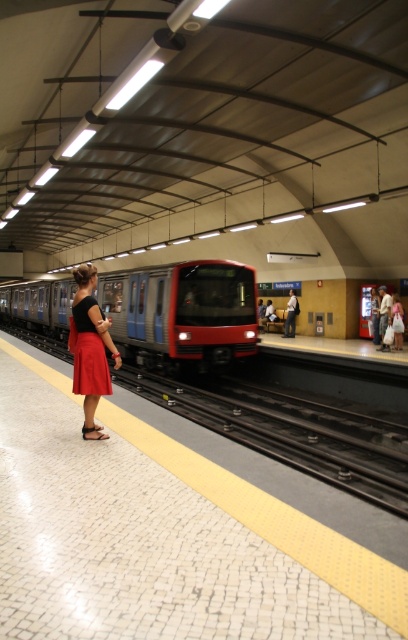
You are a passenger waiting on the subway platform. You notice the white mosaic tile platform at center and the matte red skirt at left. Which object is smaller in size?

→ The white mosaic tile platform at center is smaller in size compared to the matte red skirt at left.

You are standing on the subway platform and want to take a photo of both point (212,548) and point (132,336) in the image. Since you want both points to be in focus, which point should you focus on to ensure the other is also sharp?

You should focus on point (132,336) because it is farther from the camera than point (212,548). By focusing on the farther point, the closer point will also be within the depth of field, ensuring both are sharp.